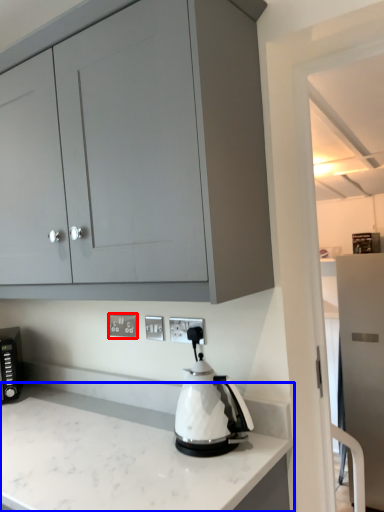
Question: Which object is further to the camera taking this photo, electric outlet (highlighted by a red box) or countertop (highlighted by a blue box)?

Choices:
 (A) electric outlet
 (B) countertop

Answer: (A)